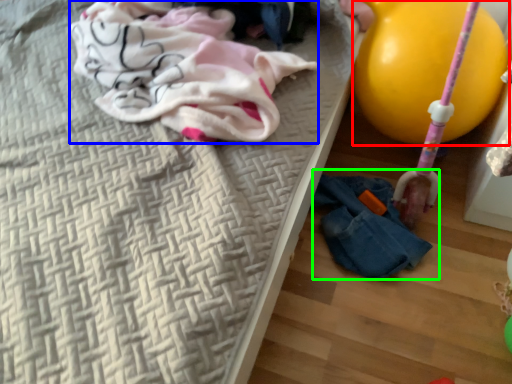
Question: Considering the real-world distances, which object is farthest from balloon (highlighted by a red box)? clothing (highlighted by a blue box) or woman (highlighted by a green box)?

Choices:
 (A) clothing
 (B) woman

Answer: (A)